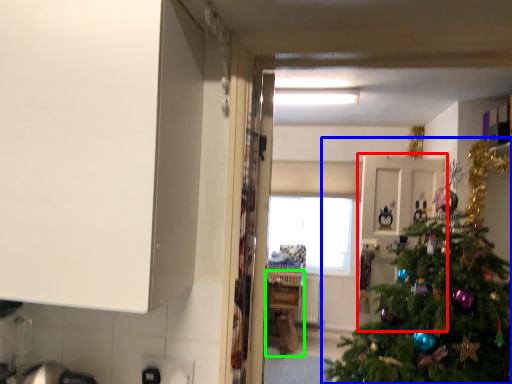
Question: Which object is positioned farthest from door (highlighted by a red box)? Select from christmas tree (highlighted by a blue box) and counter (highlighted by a green box).

Choices:
 (A) christmas tree
 (B) counter

Answer: (B)